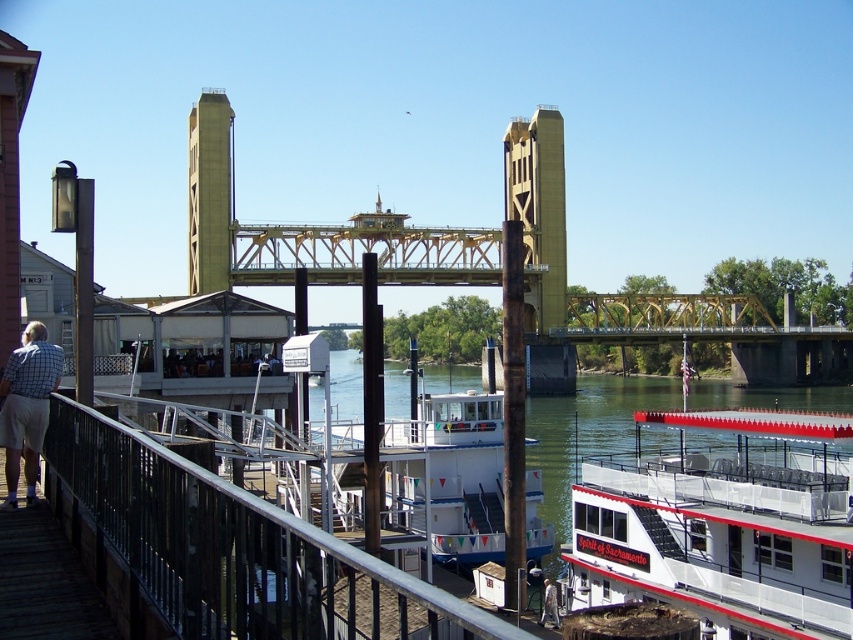
Question: Which point is farther to the camera?

Choices:
 (A) (747, 362)
 (B) (53, 344)
 (C) (341, 577)
 (D) (467, 442)

Answer: (A)

Question: Does yellow metallic bridge at center appear on the left side of checkered shirt at left?

Choices:
 (A) no
 (B) yes

Answer: (A)

Question: Can you confirm if white matte boat at lower right is positioned to the right of checkered shirt at left?

Choices:
 (A) no
 (B) yes

Answer: (B)

Question: Can you confirm if white matte boat at center is bigger than yellow metallic bridge at center?

Choices:
 (A) no
 (B) yes

Answer: (B)

Question: Which point is farther to the camera?

Choices:
 (A) (28, 442)
 (B) (427, 618)
 (C) (759, 320)
 (D) (657, 456)

Answer: (C)

Question: Which object is positioned farthest from the metallic silver railing at lower left?

Choices:
 (A) white matte boat at lower right
 (B) checkered shirt at left

Answer: (A)